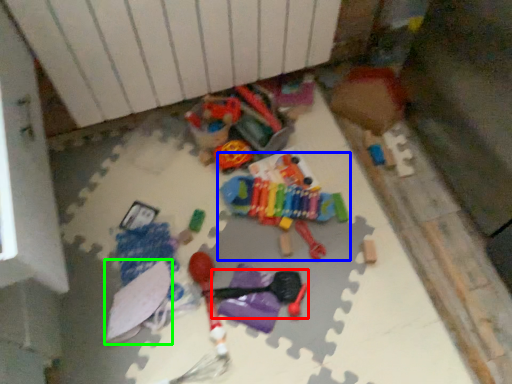
Question: Which object is the farthest from toy (highlighted by a red box)? Choose among these: toy (highlighted by a blue box) or toy (highlighted by a green box).

Choices:
 (A) toy
 (B) toy

Answer: (B)